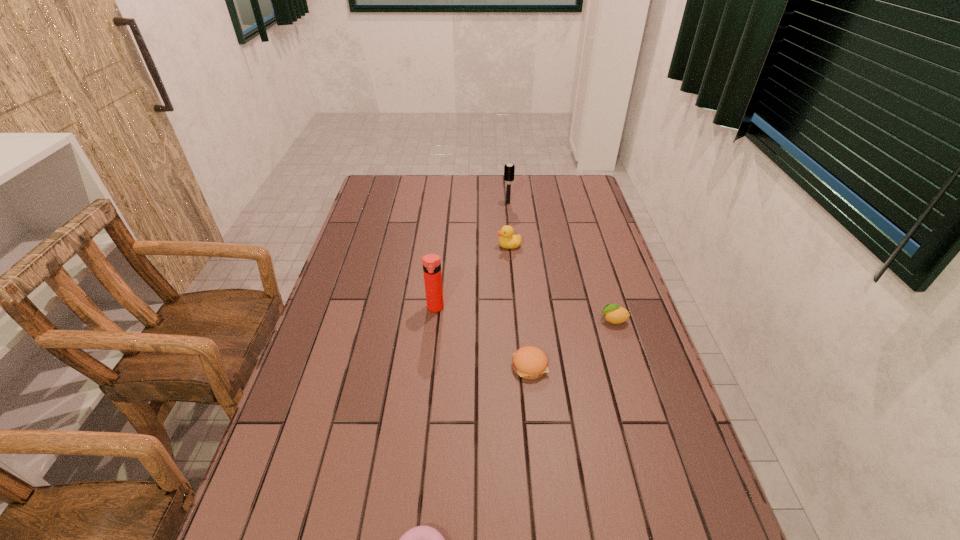
Locate an element on the screen. This screenshot has width=960, height=540. free spot at the left edge of the desktop is located at coordinates pos(358,225).

Where is `vacant space at the right edge of the desktop`? The height and width of the screenshot is (540, 960). vacant space at the right edge of the desktop is located at coordinates (582, 299).

Identify the location of vacant space at the far left corner of the desktop. (370, 190).

Image resolution: width=960 pixels, height=540 pixels. In order to click on empty space between the thermos bottle and the patty in this screenshot , I will do `click(483, 337)`.

The height and width of the screenshot is (540, 960). Identify the location of vacant area between the patty and the thermos bottle. (483, 337).

Find the location of a particular element. vacant space that's between the hairbrush and the fourth tallest object is located at coordinates (561, 261).

Locate an element on the screen. vacant region between the duckling and the second nearest object is located at coordinates (519, 306).

The height and width of the screenshot is (540, 960). Identify the location of unoccupied area between the third tallest object and the hairbrush. (509, 224).

Locate an element on the screen. free spot between the fifth farthest object and the thermos bottle is located at coordinates [x=483, y=337].

I want to click on free spot between the duckling and the thermos bottle, so click(472, 276).